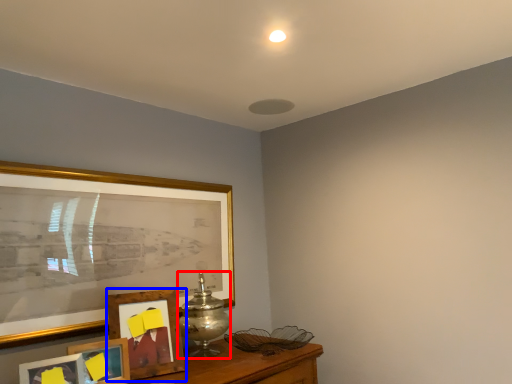
Question: Among these objects, which one is farthest to the camera, table lamp (highlighted by a red box) or picture frame (highlighted by a blue box)?

Choices:
 (A) table lamp
 (B) picture frame

Answer: (A)